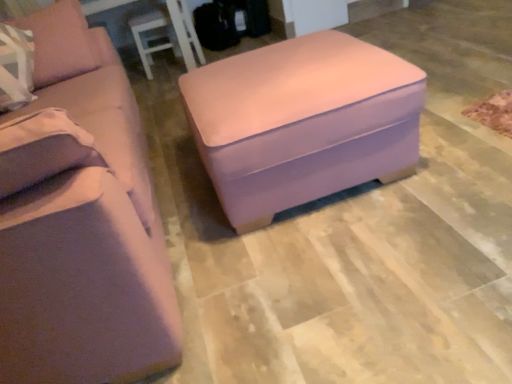
Question: Is matte pink fabric studio couch at center not inside matte pink ottoman at center?

Choices:
 (A) no
 (B) yes

Answer: (B)

Question: Considering the relative positions of matte pink fabric studio couch at center and matte pink ottoman at center in the image provided, is matte pink fabric studio couch at center to the left of matte pink ottoman at center from the viewer's perspective?

Choices:
 (A) yes
 (B) no

Answer: (A)

Question: Does matte pink fabric studio couch at center have a smaller size compared to matte pink ottoman at center?

Choices:
 (A) no
 (B) yes

Answer: (A)

Question: Does matte pink fabric studio couch at center appear on the right side of matte pink ottoman at center?

Choices:
 (A) yes
 (B) no

Answer: (B)

Question: Considering the relative positions of matte pink fabric studio couch at center and matte pink ottoman at center in the image provided, is matte pink fabric studio couch at center in front of matte pink ottoman at center?

Choices:
 (A) yes
 (B) no

Answer: (A)

Question: Considering the relative sizes of matte pink fabric studio couch at center and matte pink ottoman at center in the image provided, is matte pink fabric studio couch at center shorter than matte pink ottoman at center?

Choices:
 (A) no
 (B) yes

Answer: (A)

Question: Is matte pink ottoman at center positioned in front of matte pink fabric studio couch at center?

Choices:
 (A) no
 (B) yes

Answer: (A)

Question: Does matte pink ottoman at center have a smaller size compared to matte pink fabric studio couch at center?

Choices:
 (A) no
 (B) yes

Answer: (B)

Question: From a real-world perspective, is matte pink ottoman at center below matte pink fabric studio couch at center?

Choices:
 (A) no
 (B) yes

Answer: (B)

Question: Is matte pink ottoman at center not within matte pink fabric studio couch at center?

Choices:
 (A) yes
 (B) no

Answer: (A)

Question: From a real-world perspective, does matte pink ottoman at center stand above matte pink fabric studio couch at center?

Choices:
 (A) no
 (B) yes

Answer: (A)

Question: Is matte pink ottoman at center placed right next to matte pink fabric studio couch at center?

Choices:
 (A) no
 (B) yes

Answer: (A)

Question: Considering the relative sizes of matte pink fabric studio couch at center and suede-like beige pillow at left in the image provided, is matte pink fabric studio couch at center taller than suede-like beige pillow at left?

Choices:
 (A) yes
 (B) no

Answer: (A)